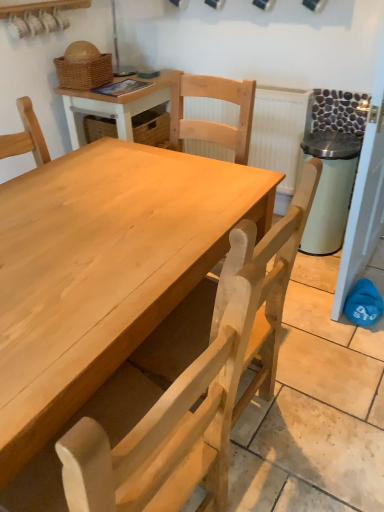
Image resolution: width=384 pixels, height=512 pixels. I want to click on empty space that is ontop of white textured radiator at upper center (from a real-world perspective), so click(280, 90).